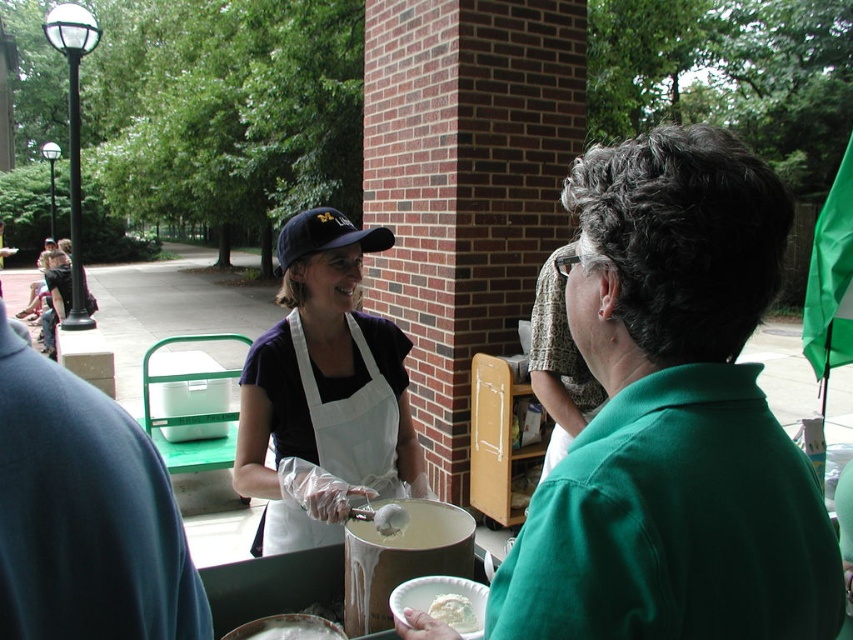
Is blue fabric shirt at left shorter than white fabric apron at center?

Correct, blue fabric shirt at left is not as tall as white fabric apron at center.

Is blue fabric shirt at left taller than white fabric apron at center?

Incorrect, blue fabric shirt at left's height is not larger of white fabric apron at center's.

Which is in front, point (25, 422) or point (378, 492)?

Point (25, 422) is more forward.

You are a GUI agent. You are given a task and a screenshot of the screen. Output one action in this format:
    pyautogui.click(x=<x>, y=<y>)
    Task: Click on the blue fabric shirt at left
    The image size is (853, 640).
    Given the screenshot: What is the action you would take?
    pyautogui.click(x=85, y=515)

Which is below, dark blue fabric baseball cap at center or white matte paper plate at center?

white matte paper plate at center

Is point (294, 220) behind point (375, 512)?

That is True.

Is point (328, 248) closer to camera compared to point (381, 531)?

No, (328, 248) is further to viewer.

Where is `dark blue fabric baseball cap at center`? dark blue fabric baseball cap at center is located at coordinates (323, 236).

Is white fabric apron at center further to the viewer compared to white matte paper plate at center?

That is True.

Which is more to the right, white fabric apron at center or white matte paper plate at center?

Positioned to the right is white matte paper plate at center.

This screenshot has width=853, height=640. In order to click on white fabric apron at center in this screenshot , I will do `click(335, 401)`.